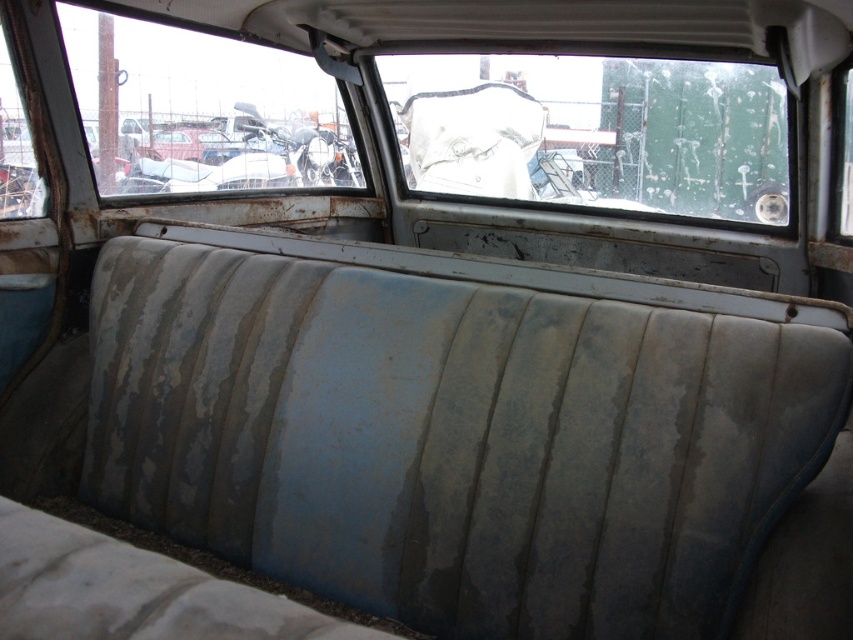
You are a passenger sitting in the back seat of the old vehicle. You want to look outside through one of the windows. Which window, the frosted glass windshield at upper center or the transparent glass window at upper left, would allow you to see the outside more clearly?

The transparent glass window at upper left would allow you to see the outside more clearly because it is behind the frosted glass windshield at upper center, meaning it is positioned further back and less obstructed.

You are sitting in the back seat of the old vehicle and notice two points marked on the seat upholstery. The first point is at coordinates point (654, 211), and the second is at point (91, 138). From your seated position, which point is closer to you?

Point (654, 211) is in front of point (91, 138), so the point closer to you is point (654, 211).

Consider the image. You are a mechanic inspecting the vehicle. You notice the frosted glass windshield at upper center and the transparent glass window at upper left. Which of these two has a greater height?

The frosted glass windshield at upper center is taller than the transparent glass window at upper left according to the description.